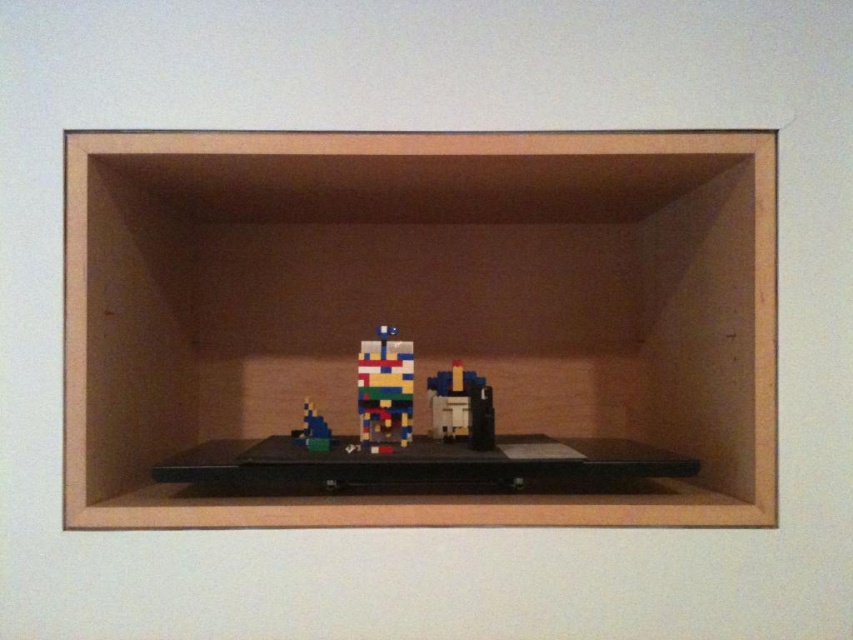
The width and height of the screenshot is (853, 640). What do you see at coordinates (421, 308) in the screenshot?
I see `wooden shelf at center` at bounding box center [421, 308].

Who is positioned more to the left, wooden shelf at center or multicolored plastic toy at center?

From the viewer's perspective, multicolored plastic toy at center appears more on the left side.

The image size is (853, 640). Find the location of `wooden shelf at center`. wooden shelf at center is located at coordinates tap(421, 308).

From the picture: Which of these two, multicolored plastic toy at center or pixelated blue toy at center, stands taller?

multicolored plastic toy at center is taller.

Based on the photo, between multicolored plastic toy at center and pixelated blue toy at center, which one has less height?

pixelated blue toy at center is shorter.

Is point (389, 342) positioned before point (294, 438)?

Yes, it is.

The height and width of the screenshot is (640, 853). I want to click on multicolored plastic toy at center, so click(384, 392).

Can you confirm if matte plastic toy at center is smaller than pixelated blue toy at center?

Actually, matte plastic toy at center might be larger than pixelated blue toy at center.

Is point (479, 426) less distant than point (320, 448)?

Yes.

Identify the location of matte plastic toy at center. 461,406.